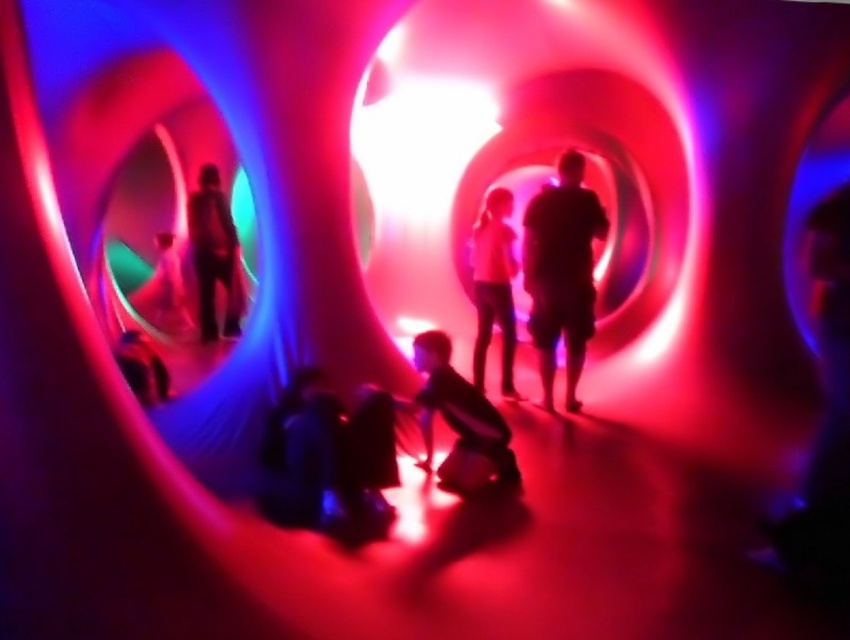
You are a photographer planning to take a group photo of the dark matte clothing at center and the matte black suit at center inside the tunnel. Since the tunnel has limited space, you need to know which of the two objects takes up more horizontal space. Which one is wider?

The dark matte clothing at center is wider than the matte black suit at center because its width is larger, as stated in the description.

You are a photographer positioned at the entrance of the tunnel. You want to take a photo that includes both the dark matte clothing at center and the pink matte shirt at center. Which object should you focus on first if you want to ensure both are in sharp focus?

The dark matte clothing at center is shorter than the pink matte shirt at center. To ensure both are in sharp focus, you should focus on the pink matte shirt at center first since it is farther away, allowing the depth of field to cover the closer dark matte clothing at center.

From the picture: You are designing a poster for this installation and need to ensure the silhouette human at center and the pink matte shirt at center are scaled appropriately. Which object should be made larger in the poster to maintain the original scene proportions?

The silhouette human at center should be made larger than the pink matte shirt at center in the poster to maintain the original scene proportions, as the silhouette human at center is wider than the pink matte shirt at center in the scene.